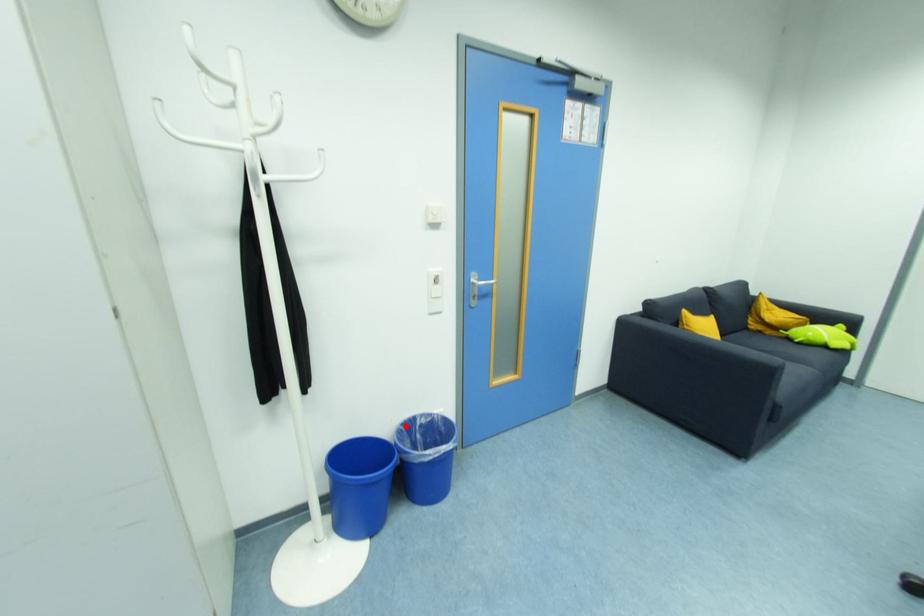
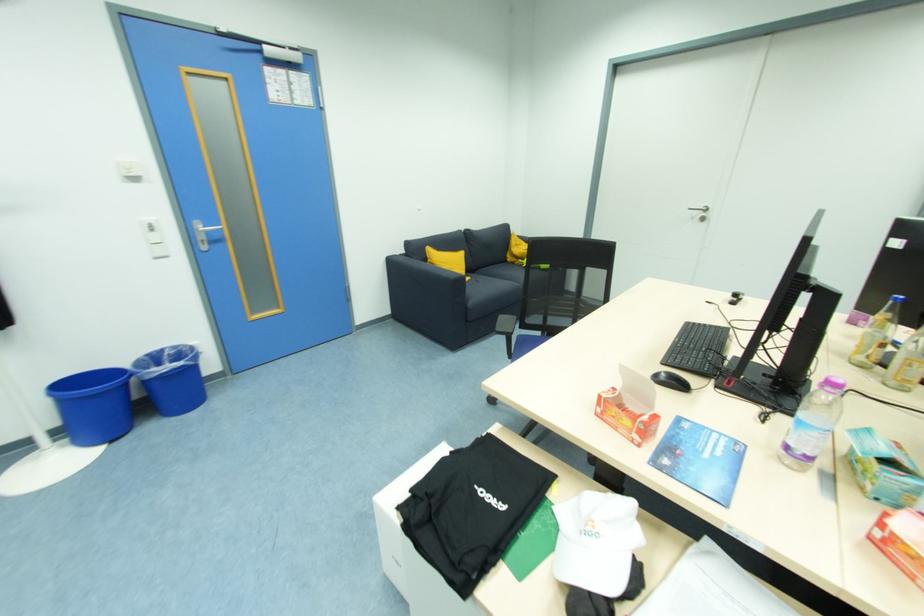
The point at the highlighted location is marked in the first image. Where is the corresponding point in the second image?

(151, 357)